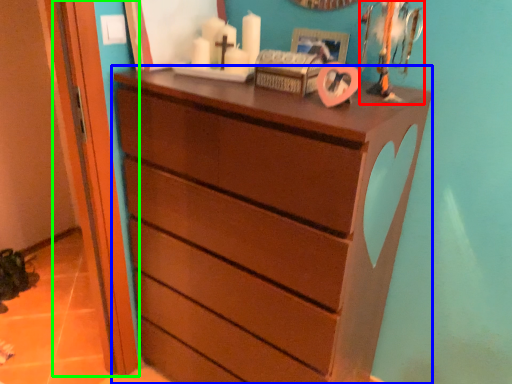
Question: Which object is positioned farthest from toy (highlighted by a red box)? Select from chest of drawers (highlighted by a blue box) and door (highlighted by a green box).

Choices:
 (A) chest of drawers
 (B) door

Answer: (B)